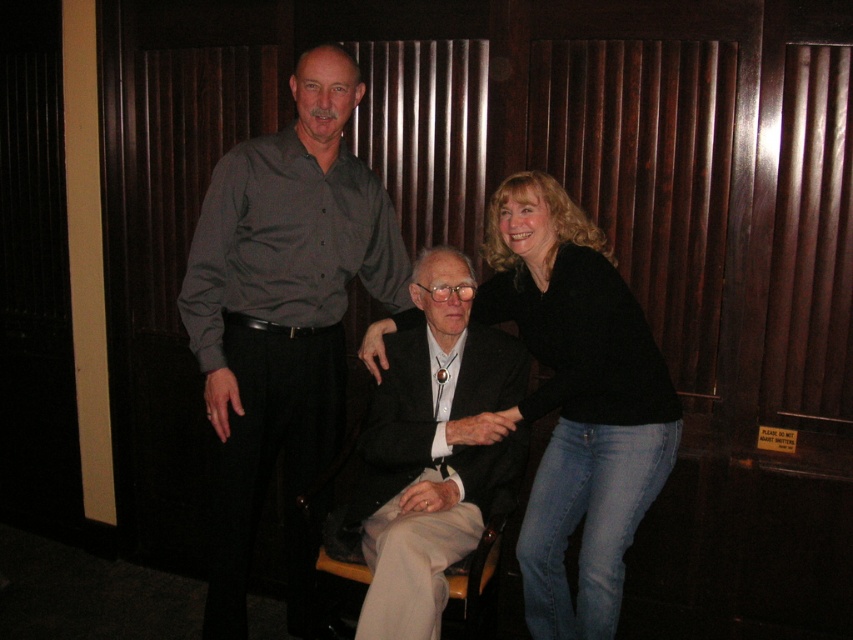
What are the coordinates of the matte gray shirt at upper left in the image?

The coordinates of the matte gray shirt at upper left are at point (x=283, y=316).

You are a photographer trying to capture a portrait of the matte gray shirt at upper left and the black shirt at upper center. Since the lighting is focused on the subjects, which subject should you adjust the camera focus to prioritize to ensure both are properly lit?

The matte gray shirt at upper left should be prioritized because it is above the black shirt at upper center, so it might receive more direct light from the focused lighting, ensuring both are properly lit.

You are a photographer setting up for a group photo. You have to ensure that the black shirt at upper center and the black wool suit at center are visible in the frame. Given their height difference, which one might require you to adjust your camera angle upwards to capture properly?

The black shirt at upper center is much taller than the black wool suit at center, so you would need to adjust your camera angle upwards to capture the black shirt at upper center properly.